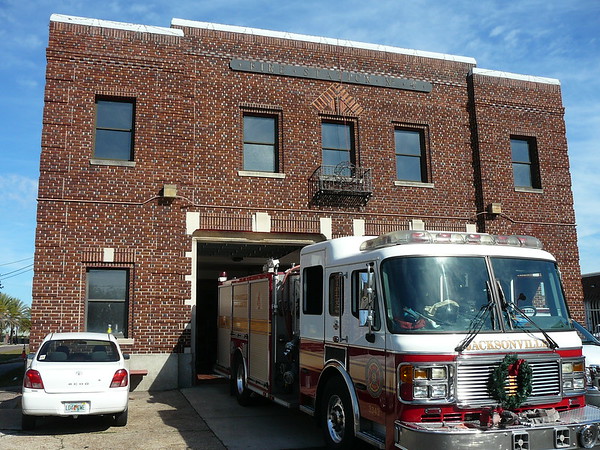
Locate an element on the screen. This screenshot has width=600, height=450. window is located at coordinates (114, 143).